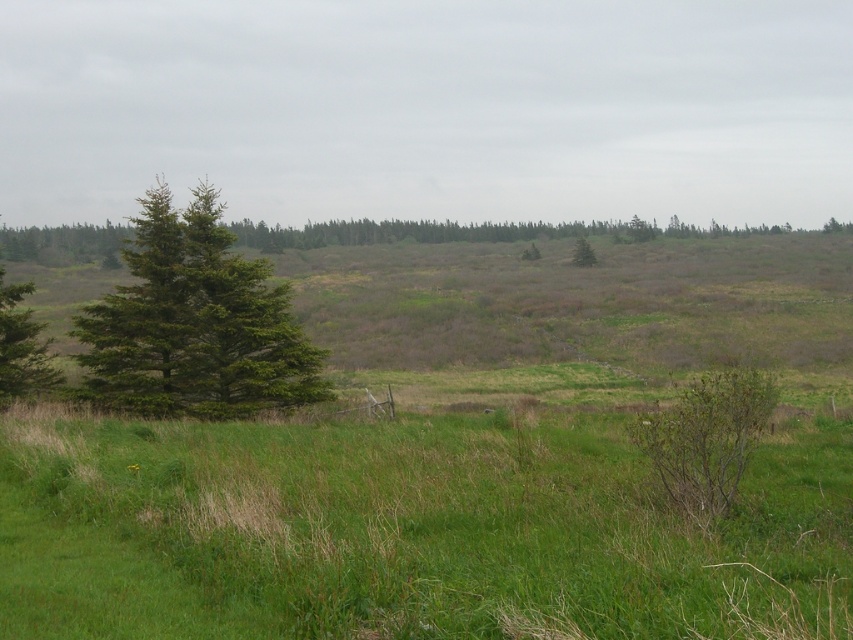
Question: Is green matte tree at left to the left of green matte tree at center from the viewer's perspective?

Choices:
 (A) yes
 (B) no

Answer: (A)

Question: Which point is farther from the camera taking this photo?

Choices:
 (A) (27, 353)
 (B) (231, 291)

Answer: (B)

Question: In this image, where is green matte tree at left located relative to green matte tree at center?

Choices:
 (A) above
 (B) below

Answer: (A)

Question: Estimate the real-world distances between objects in this image. Which object is closer to the green needle-like at left?

Choices:
 (A) green matte tree at center
 (B) green matte tree at left

Answer: (B)

Question: Which of the following is the farthest from the observer?

Choices:
 (A) green matte tree at left
 (B) green needle-like at left
 (C) green matte tree at center

Answer: (C)

Question: Is green matte tree at left above green matte tree at center?

Choices:
 (A) yes
 (B) no

Answer: (A)